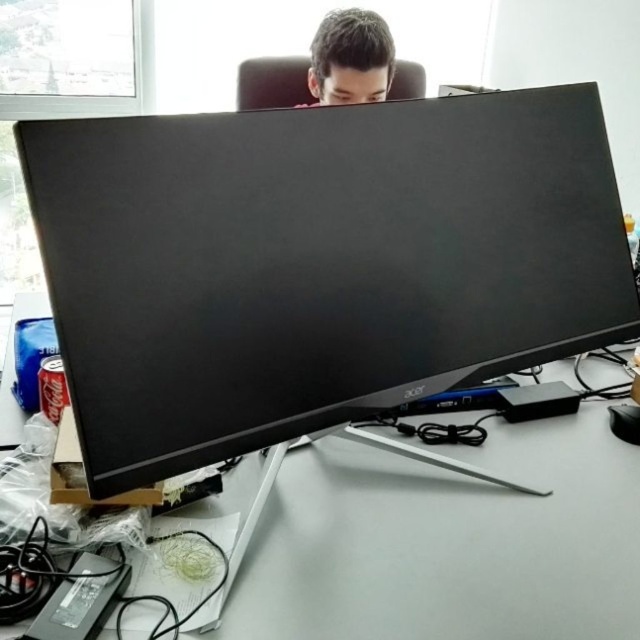
Does black matte monitor at center appear on the left side of white plastic computer desk at center?

Yes, black matte monitor at center is to the left of white plastic computer desk at center.

Who is positioned more to the left, black matte monitor at center or white plastic computer desk at center?

black matte monitor at center

This screenshot has height=640, width=640. Describe the element at coordinates (316, 262) in the screenshot. I see `black matte monitor at center` at that location.

Where is `black matte monitor at center`? This screenshot has height=640, width=640. black matte monitor at center is located at coordinates (316, 262).

Between black matte monitor at center and brown matte hair at upper center, which one is positioned lower?

Positioned lower is black matte monitor at center.

Is point (484, 353) positioned in front of point (353, 8)?

Yes, it is in front of point (353, 8).

You are a GUI agent. You are given a task and a screenshot of the screen. Output one action in this format:
    pyautogui.click(x=<x>, y=<y>)
    Task: Click on the black matte monitor at center
    The width and height of the screenshot is (640, 640).
    Given the screenshot: What is the action you would take?
    pyautogui.click(x=316, y=262)

Between point (332, 476) and point (324, 81), which one is positioned behind?

The point (324, 81) is more distant.

Is white plastic computer desk at center wider than brown matte hair at upper center?

Yes.

Which is behind, point (493, 554) or point (380, 28)?

Positioned behind is point (380, 28).

Where is `white plastic computer desk at center`? white plastic computer desk at center is located at coordinates (438, 540).